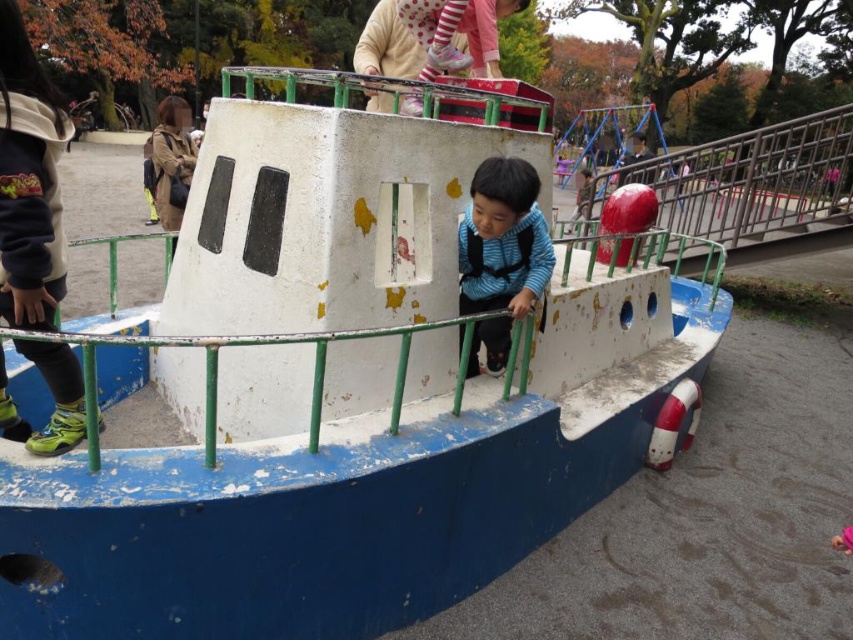
Question: Which object appears farthest from the camera in this image?

Choices:
 (A) metallic green railing at upper right
 (B) blue matte vest at center
 (C) white rubber lifebuoy at lower right

Answer: (A)

Question: Which point is closer to the camera taking this photo?

Choices:
 (A) (662, 468)
 (B) (462, 284)
 (C) (729, 246)

Answer: (B)

Question: Does metallic green railing at upper right come behind blue matte vest at center?

Choices:
 (A) yes
 (B) no

Answer: (A)

Question: Can you confirm if metallic green railing at upper right is positioned below white rubber lifebuoy at lower right?

Choices:
 (A) yes
 (B) no

Answer: (B)

Question: Which point is closer to the camera?

Choices:
 (A) white rubber lifebuoy at lower right
 (B) blue matte vest at center

Answer: (B)

Question: In this image, where is blue matte vest at center located relative to white rubber lifebuoy at lower right?

Choices:
 (A) right
 (B) left

Answer: (B)